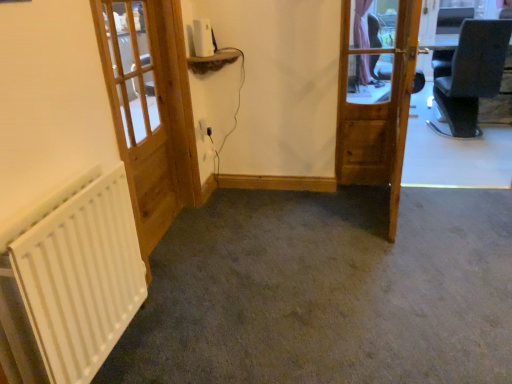
Question: Does wooden door at center, the first door from the right, have a larger size compared to white wooden door at left, which is the first door in left-to-right order?

Choices:
 (A) no
 (B) yes

Answer: (A)

Question: Is wooden door at center, the first door from the right, oriented away from white wooden door at left, which is the first door in left-to-right order?

Choices:
 (A) yes
 (B) no

Answer: (A)

Question: Does wooden door at center, the first door from the right, have a greater height compared to white wooden door at left, which is the first door in left-to-right order?

Choices:
 (A) yes
 (B) no

Answer: (B)

Question: From a real-world perspective, is wooden door at center, the first door from the right, located beneath white wooden door at left, which is the first door in left-to-right order?

Choices:
 (A) yes
 (B) no

Answer: (A)

Question: Considering the relative sizes of wooden door at center, the first door from the right, and white wooden door at left, marked as the second door in a right-to-left arrangement, in the image provided, is wooden door at center, the first door from the right, thinner than white wooden door at left, marked as the second door in a right-to-left arrangement,?

Choices:
 (A) yes
 (B) no

Answer: (A)

Question: Is wooden door at center, acting as the second door starting from the left, directly adjacent to white wooden door at left, which is the first door in left-to-right order?

Choices:
 (A) no
 (B) yes

Answer: (A)

Question: From a real-world perspective, is wooden door at center, acting as the second door starting from the left, over white matte radiator at lower left?

Choices:
 (A) no
 (B) yes

Answer: (B)

Question: Is the position of wooden door at center, the first door from the right, more distant than that of white matte radiator at lower left?

Choices:
 (A) yes
 (B) no

Answer: (A)

Question: Is the surface of wooden door at center, the first door from the right, in direct contact with white matte radiator at lower left?

Choices:
 (A) no
 (B) yes

Answer: (A)

Question: Is wooden door at center, acting as the second door starting from the left, positioned with its back to white matte radiator at lower left?

Choices:
 (A) no
 (B) yes

Answer: (A)

Question: Could you tell me if wooden door at center, acting as the second door starting from the left, is turned towards white matte radiator at lower left?

Choices:
 (A) yes
 (B) no

Answer: (B)

Question: Is wooden door at center, the first door from the right, to the left of white matte radiator at lower left from the viewer's perspective?

Choices:
 (A) no
 (B) yes

Answer: (A)

Question: Is white matte radiator at lower left directly adjacent to wooden door at center, the first door from the right?

Choices:
 (A) no
 (B) yes

Answer: (A)